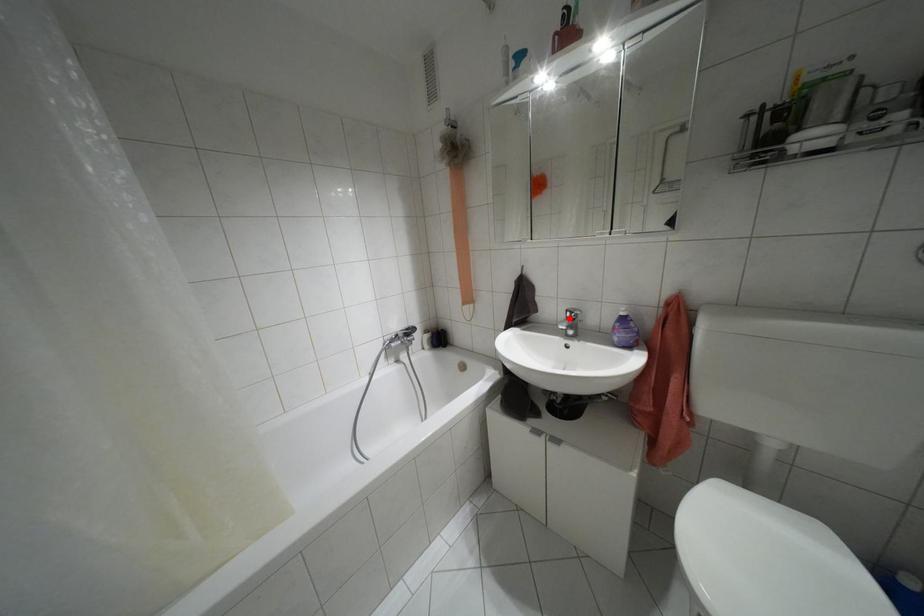
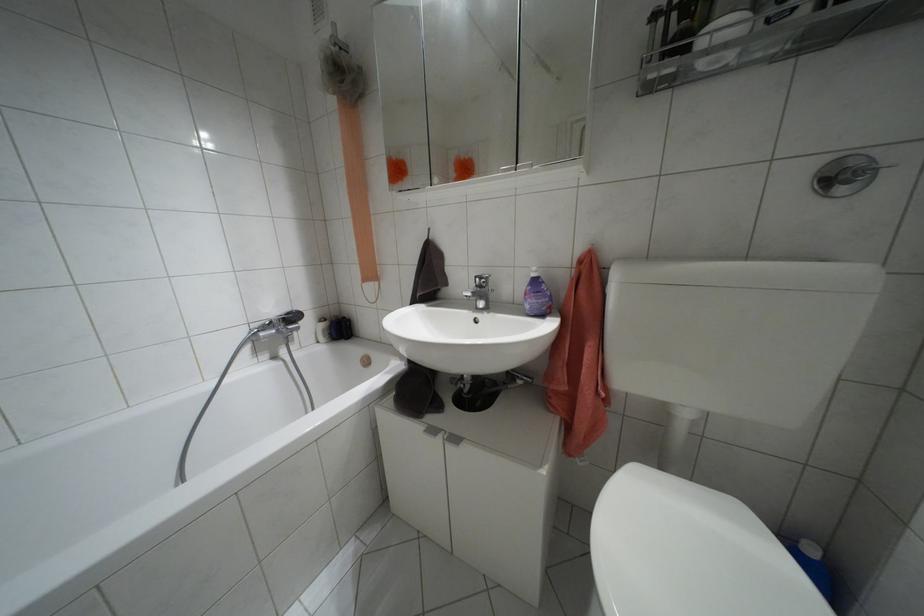
In the second image, find the point that corresponds to the highlighted location in the first image.

(479, 286)